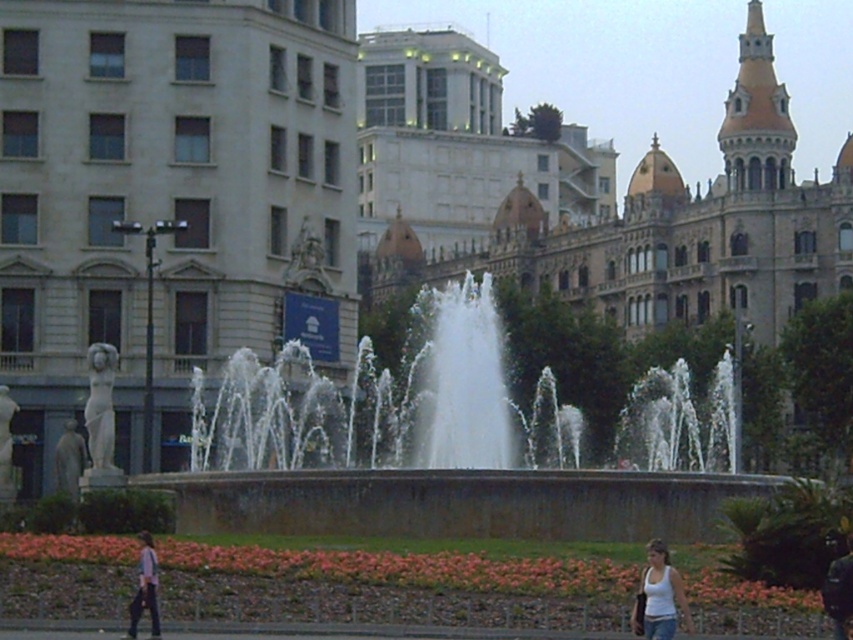
Based on the photo, you are a tourist visiting the fountain area and see the white marble statue at left and the white cotton tank top at lower right. Which object is located more to the left side of the scene?

The white marble statue at left is positioned on the left side of the white cotton tank top at lower right, so the white marble statue at left is more to the left.

You are standing at the point with coordinates point (610, 205) in the image. What is the object located at this point?

The point (610, 205) corresponds to the golden stone palace at center.